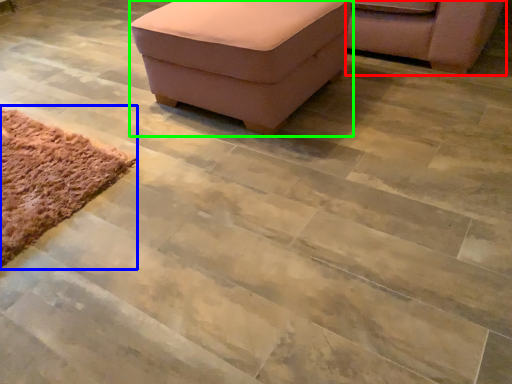
Question: Which object is the closest to the chair (highlighted by a red box)? Choose among these: mat (highlighted by a blue box) or furniture (highlighted by a green box).

Choices:
 (A) mat
 (B) furniture

Answer: (B)